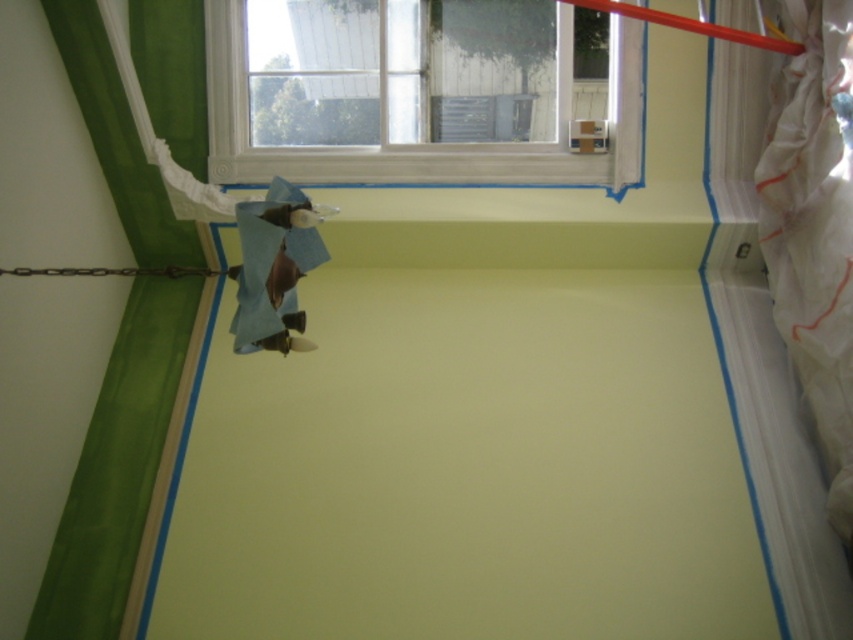
Question: Which point is closer to the camera?

Choices:
 (A) (315, 168)
 (B) (769, 220)

Answer: (B)

Question: Which object is farther from the camera taking this photo?

Choices:
 (A) white painted wood window at upper center
 (B) white plastic curtain at right

Answer: (A)

Question: Where is white painted wood window at upper center located in relation to white plastic curtain at right in the image?

Choices:
 (A) above
 (B) below

Answer: (A)

Question: Does white painted wood window at upper center appear on the left side of white plastic curtain at right?

Choices:
 (A) no
 (B) yes

Answer: (B)

Question: Is white painted wood window at upper center smaller than white plastic curtain at right?

Choices:
 (A) yes
 (B) no

Answer: (B)

Question: Which object is closer to the camera taking this photo?

Choices:
 (A) white painted wood window at upper center
 (B) white plastic curtain at right

Answer: (B)